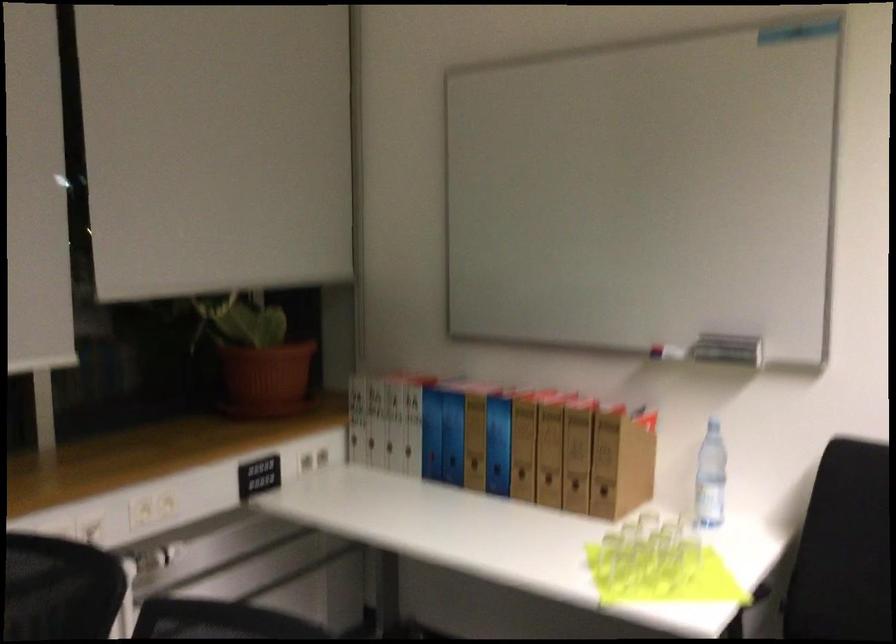
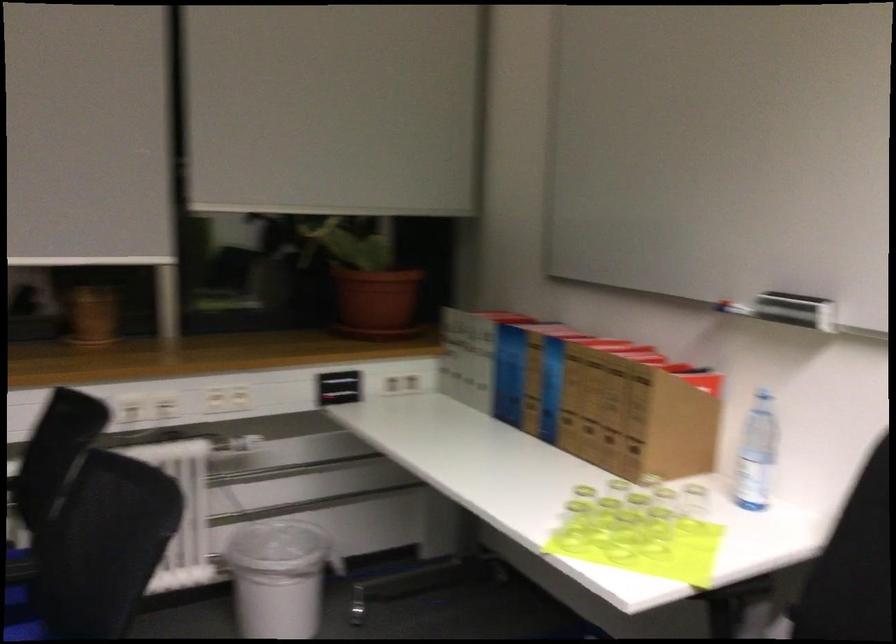
Find the pixel in the second image that matches [446,437] in the first image.

(509, 374)